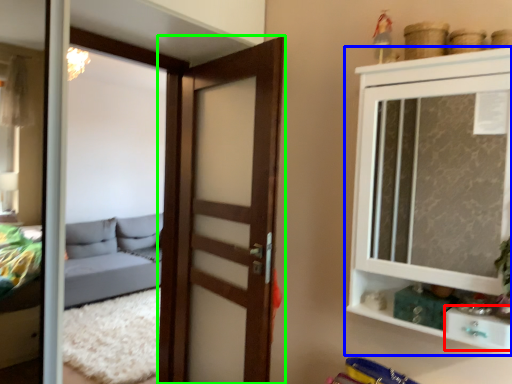
Question: Based on their relative distances, which object is nearer to drawer (highlighted by a red box)? Choose from cupboard (highlighted by a blue box) and door (highlighted by a green box).

Choices:
 (A) cupboard
 (B) door

Answer: (A)